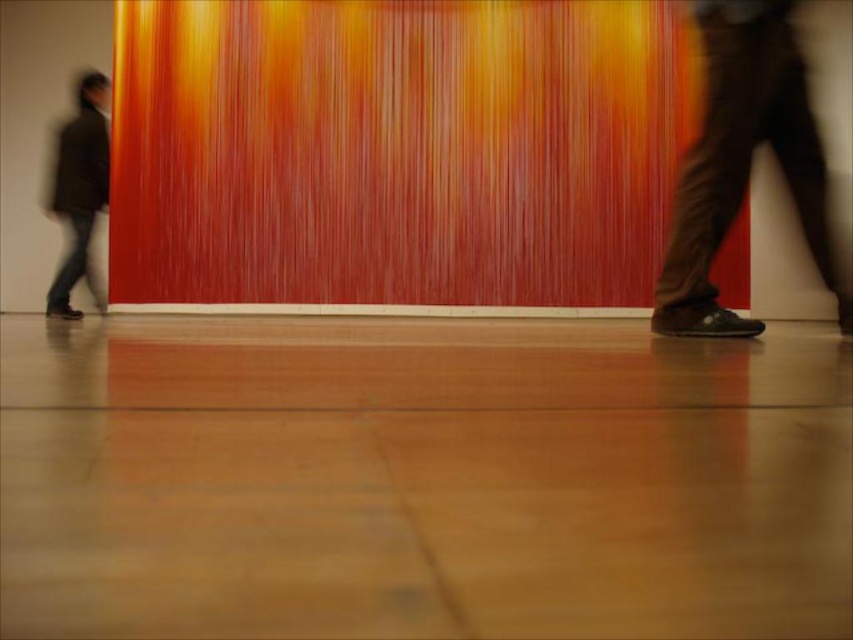
Question: Does brown leather shoes at right appear over dark brown leather jacket at left?

Choices:
 (A) no
 (B) yes

Answer: (A)

Question: Among these points, which one is farthest from the camera?

Choices:
 (A) (74, 144)
 (B) (735, 317)

Answer: (A)

Question: Can you confirm if brown leather shoes at right is smaller than dark brown leather jacket at left?

Choices:
 (A) no
 (B) yes

Answer: (B)

Question: Which of the following is the farthest from the observer?

Choices:
 (A) dark brown leather jacket at left
 (B) brown leather shoes at right

Answer: (A)

Question: Does brown leather shoes at right appear on the right side of dark brown leather jacket at left?

Choices:
 (A) yes
 (B) no

Answer: (A)

Question: Which point is closer to the camera taking this photo?

Choices:
 (A) (821, 211)
 (B) (102, 204)

Answer: (A)